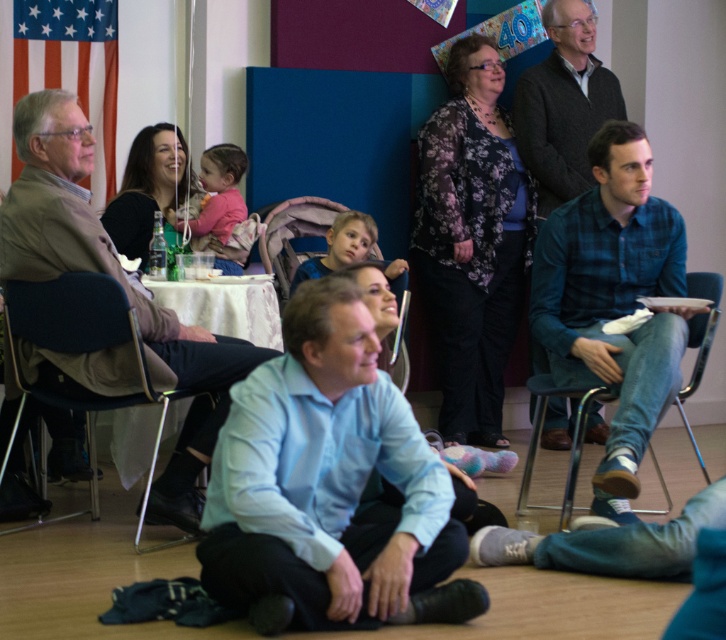
Does matte brown jacket at left have a lesser width compared to metallic blue chair at right?

No.

Is matte brown jacket at left wider than metallic blue chair at right?

Yes.

Locate an element on the screen. matte brown jacket at left is located at coordinates (118, 284).

Find the location of a particular element. matte brown jacket at left is located at coordinates pyautogui.click(x=118, y=284).

Which is below, matte brown jacket at left or matte plastic chair at center?

matte brown jacket at left

Which is in front, point (49, 166) or point (363, 288)?

Point (363, 288)

Locate an element on the screen. This screenshot has height=640, width=726. matte brown jacket at left is located at coordinates (118, 284).

Between light blue shirt at center and matte plastic chair at center, which one has less height?

matte plastic chair at center is shorter.

Does light blue shirt at center appear under matte plastic chair at center?

Yes, light blue shirt at center is below matte plastic chair at center.

Is point (335, 285) positioned before point (386, 289)?

Yes, point (335, 285) is closer to viewer.

Identify the location of light blue shirt at center. This screenshot has height=640, width=726. (327, 483).